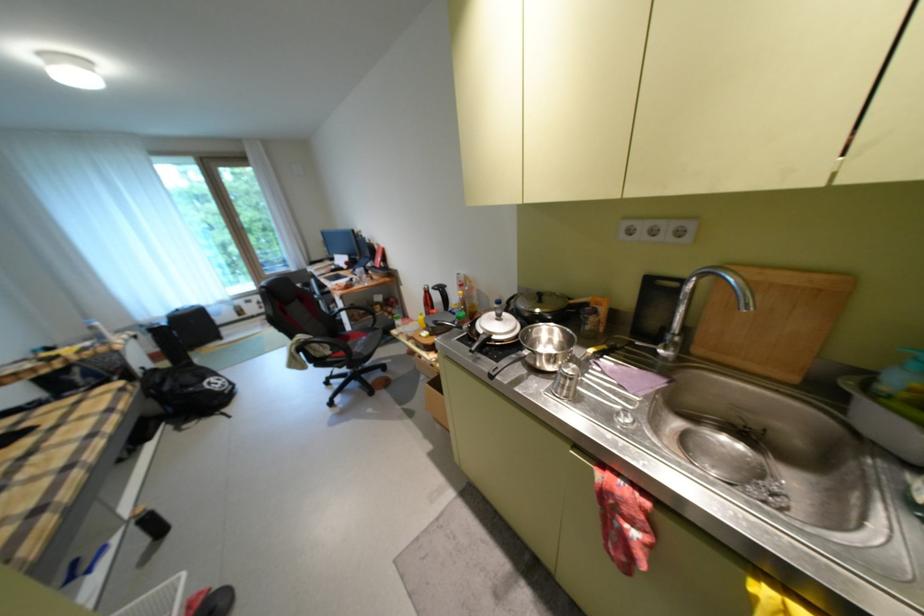
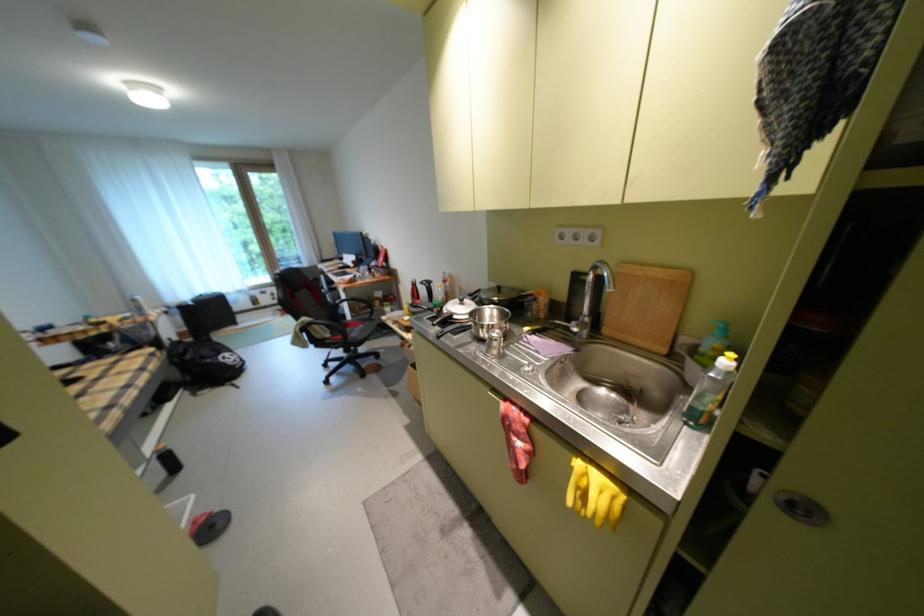
Locate, in the second image, the point that corresponds to point 685,336 in the first image.

(596, 317)